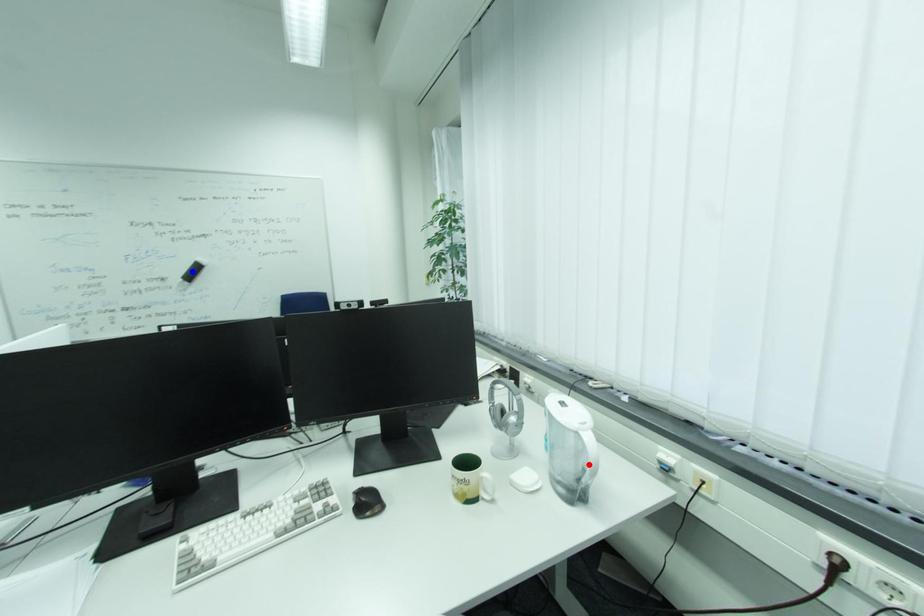
Question: Two points are marked on the image. Which point is closer to the camera?

Choices:
 (A) Blue point is closer.
 (B) Red point is closer.

Answer: (B)